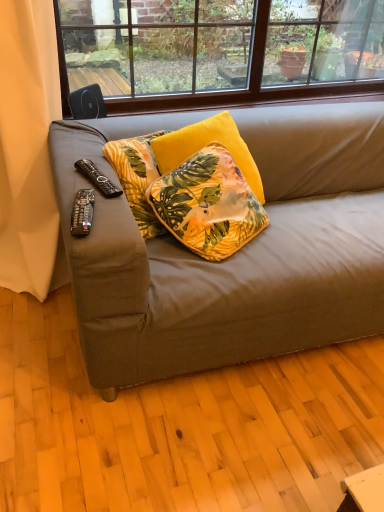
What are the coordinates of `vacant space that is to the left of black plastic remote at left, which ranks as the first remote control in back-to-front order` in the screenshot? It's located at (62, 168).